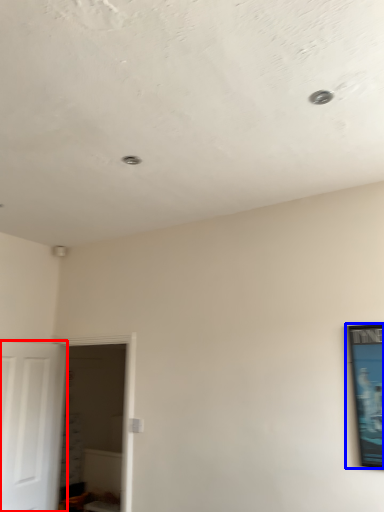
Question: Which point is closer to the camera, door (highlighted by a red box) or picture frame (highlighted by a blue box)?

Choices:
 (A) door
 (B) picture frame

Answer: (B)